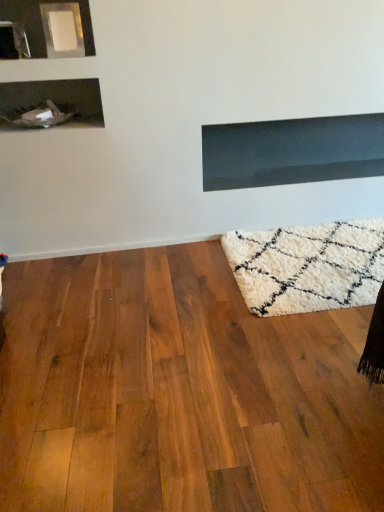
Question: Looking at the image, does shiny brown hardwood floor at lower right seem bigger or smaller compared to matte black fireplace at upper center?

Choices:
 (A) small
 (B) big

Answer: (B)

Question: Is shiny brown hardwood floor at lower right wider or thinner than matte black fireplace at upper center?

Choices:
 (A) thin
 (B) wide

Answer: (B)

Question: In terms of height, does shiny brown hardwood floor at lower right look taller or shorter compared to matte black fireplace at upper center?

Choices:
 (A) short
 (B) tall

Answer: (A)

Question: Is matte black fireplace at upper center situated inside shiny brown hardwood floor at lower right or outside?

Choices:
 (A) inside
 (B) outside

Answer: (B)

Question: Is matte black fireplace at upper center in front of or behind shiny brown hardwood floor at lower right in the image?

Choices:
 (A) front
 (B) behind

Answer: (B)

Question: Is matte black fireplace at upper center wider or thinner than shiny brown hardwood floor at lower right?

Choices:
 (A) wide
 (B) thin

Answer: (B)

Question: In terms of size, does matte black fireplace at upper center appear bigger or smaller than shiny brown hardwood floor at lower right?

Choices:
 (A) big
 (B) small

Answer: (B)